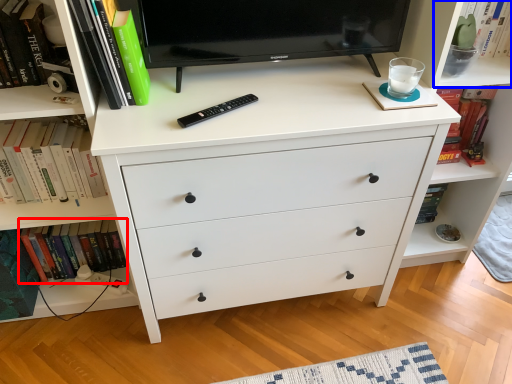
Question: Which object appears farthest to the camera in this image, book (highlighted by a red box) or shelf (highlighted by a blue box)?

Choices:
 (A) book
 (B) shelf

Answer: (A)